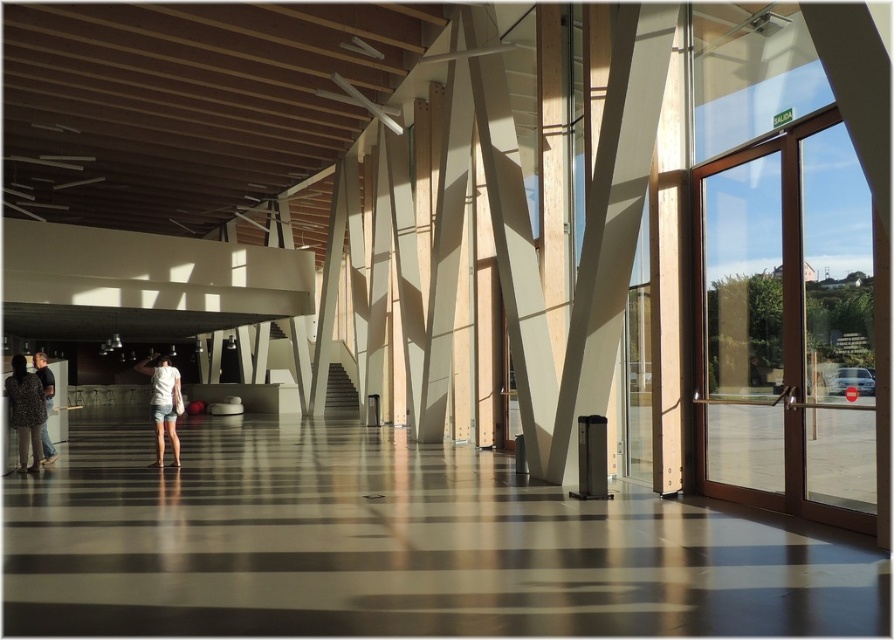
You are a security guard in the building and need to check the items left on the floor. You see a white cotton shirt at center and a leather jacket at left. Which item is closer to you?

The white cotton shirt at center is closer to you because it is in front of the leather jacket at left.